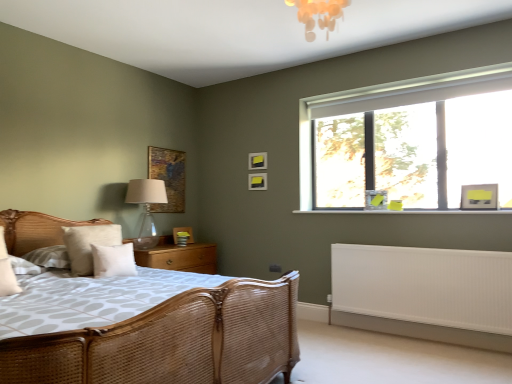
Question: Considering their positions, is translucent glass table lamp at left located in front of or behind wooden at left?

Choices:
 (A) front
 (B) behind

Answer: (A)

Question: Considering the positions of point (144, 230) and point (137, 253), is point (144, 230) closer or farther from the camera than point (137, 253)?

Choices:
 (A) farther
 (B) closer

Answer: (A)

Question: Which is farther from the beige fabric pillow at left, which is counted as the first pillow, starting from the left?

Choices:
 (A) translucent glass table lamp at left
 (B) clear glass window at upper right
 (C) wooden at left
 (D) matte gray picture frame at right, the 1th picture frame positioned from the front
 (E) wooden textured picture frame at upper center, acting as the 1th picture frame starting from the left

Answer: (D)

Question: Which is farther from the translucent glass table lamp at left?

Choices:
 (A) matte black picture frame at upper center, the second picture frame in the right-to-left sequence
 (B) matte black picture frame at upper center, the 3th picture frame from the left
 (C) woven rattan bed at left
 (D) wooden picture frame at lower center, the 4th picture frame positioned from the right
 (E) white soft pillow at center, acting as the second pillow starting from the left

Answer: (C)